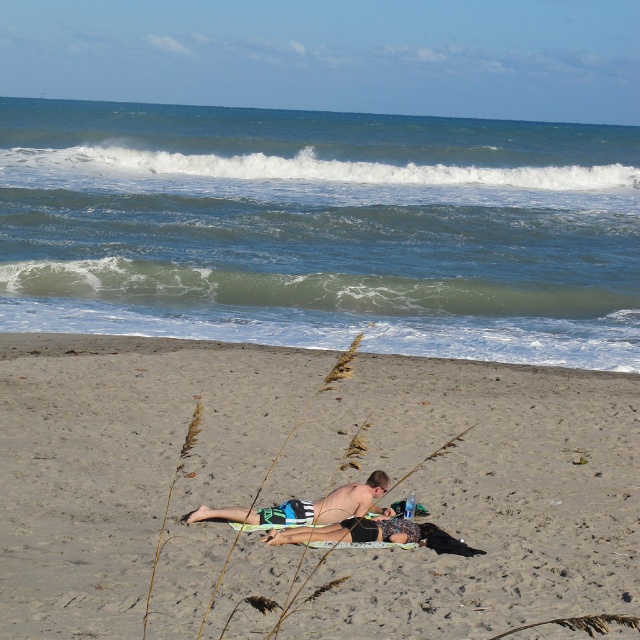
You are standing on the beach and see a printed fabric bikini at center and a skinny tan man at center. Which object is wider?

The printed fabric bikini at center is wider than the skinny tan man at center.

From the picture: You are standing on the beach and see two points marked on the sand. The first point is at coordinates point (412, 525), and the second is at point (384, 508). Which point is closer to you?

Point (412, 525) is closer to the viewer than point (384, 508).

You are standing on the sandy beach at lower center and want to walk towards the tan skin man at center. Which direction should you move to get closer to him?

The sandy beach at lower center is closer to the viewer than the tan skin man at center, so to reach him, you should move forward towards the direction where the tan skin man at center is located, as he is further away from your current position.